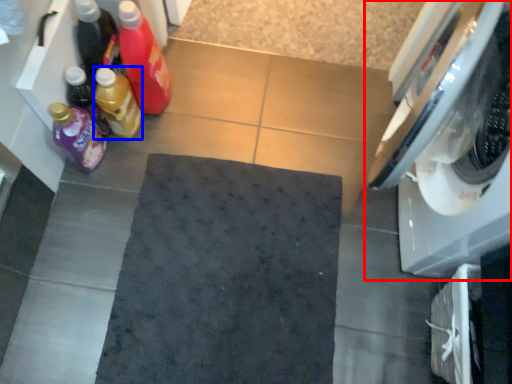
Question: Which point is further to the camera, washing machine (highlighted by a red box) or bottle (highlighted by a blue box)?

Choices:
 (A) washing machine
 (B) bottle

Answer: (B)